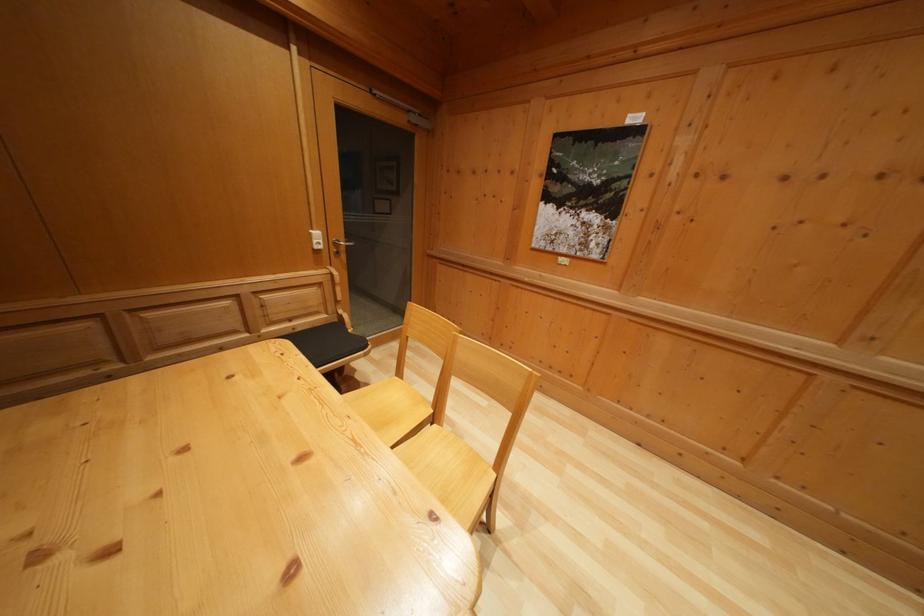
Locate an element on the screen. Image resolution: width=924 pixels, height=616 pixels. bench sitting surface is located at coordinates (327, 342).